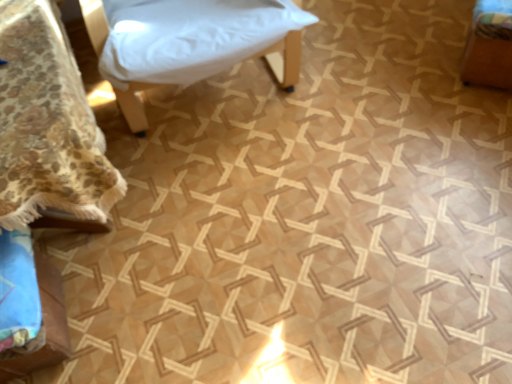
At what (x,y) coordinates should I click in order to perform the action: click on free location in front of wooden box at right, acting as the 4th furniture starting from the left. Please return your answer as a coordinate pair (x, y). The width and height of the screenshot is (512, 384). Looking at the image, I should click on (478, 120).